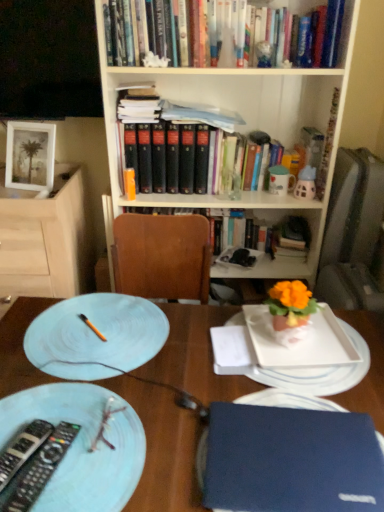
At what (x,y) coordinates should I click in order to perform the action: click on vacant area that lies to the right of black plastic remote control at lower left. Please return your answer as a coordinate pair (x, y). This screenshot has height=512, width=384. Looking at the image, I should click on (127, 463).